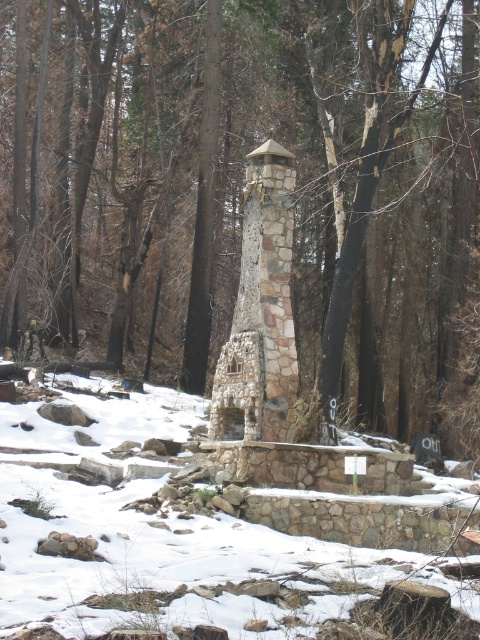
You are standing in the snowy forest and see the smooth bark tree at center and the white powdery snow at center. Which object is closer to you?

The smooth bark tree at center is closer to you because the white powdery snow at center is behind it.

You are standing in the snowy forest and want to touch both the smooth bark tree at center and the stone textured chimney at center. Which one can you reach first without moving your feet?

The smooth bark tree at center is closer to you than the stone textured chimney at center, so you can reach it first without moving your feet.

You are an architect designing a winter garden. You see a smooth bark tree at center and a stone textured chimney at center in the image. Which object is wider? Please answer based on their widths.

The smooth bark tree at center is wider than the stone textured chimney at center because the smooth bark tree at center has a greater width according to the description.